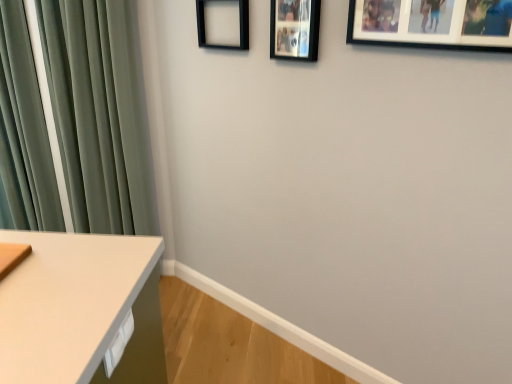
Question: From the image's perspective, is black matte picture frame at upper center, marked as the second picture frame in a right-to-left arrangement, below green velvet curtain at left?

Choices:
 (A) no
 (B) yes

Answer: (A)

Question: Does black matte picture frame at upper center, marked as the second picture frame in a right-to-left arrangement, have a larger size compared to green velvet curtain at left?

Choices:
 (A) no
 (B) yes

Answer: (A)

Question: Is black matte picture frame at upper center, placed as the 2th picture frame when sorted from back to front, at the right side of green velvet curtain at left?

Choices:
 (A) no
 (B) yes

Answer: (B)

Question: Does black matte picture frame at upper center, marked as the second picture frame in a right-to-left arrangement, have a lesser width compared to green velvet curtain at left?

Choices:
 (A) yes
 (B) no

Answer: (A)

Question: From a real-world perspective, is black matte picture frame at upper center, marked as the second picture frame in a right-to-left arrangement, physically above green velvet curtain at left?

Choices:
 (A) yes
 (B) no

Answer: (A)

Question: In terms of height, does black matte picture frame at upper right, which is the third picture frame from back to front, look taller or shorter compared to black matte picture frame at upper center, positioned as the 3th picture frame in front-to-back order?

Choices:
 (A) short
 (B) tall

Answer: (A)

Question: Looking at their shapes, would you say black matte picture frame at upper right, the 1th picture frame in the front-to-back sequence, is wider or thinner than black matte picture frame at upper center, the 1th picture frame positioned from the back?

Choices:
 (A) thin
 (B) wide

Answer: (B)

Question: From the image's perspective, is black matte picture frame at upper right, the 1th picture frame in the front-to-back sequence, positioned above or below black matte picture frame at upper center, which is the 3th picture frame in right-to-left order?

Choices:
 (A) below
 (B) above

Answer: (A)

Question: Which is correct: black matte picture frame at upper right, which is the third picture frame from back to front, is inside black matte picture frame at upper center, the 1th picture frame positioned from the back, or outside of it?

Choices:
 (A) outside
 (B) inside

Answer: (A)

Question: Based on their positions, is white glossy drawer at lower left located to the left or right of black matte picture frame at upper center, which appears as the first picture frame when viewed from the left?

Choices:
 (A) left
 (B) right

Answer: (A)

Question: Is white glossy drawer at lower left wider or thinner than black matte picture frame at upper center, which appears as the first picture frame when viewed from the left?

Choices:
 (A) thin
 (B) wide

Answer: (A)

Question: Is white glossy drawer at lower left in front of or behind black matte picture frame at upper center, which is the 3th picture frame in right-to-left order, in the image?

Choices:
 (A) behind
 (B) front

Answer: (B)

Question: From the image's perspective, is white glossy drawer at lower left above or below black matte picture frame at upper center, positioned as the 3th picture frame in front-to-back order?

Choices:
 (A) above
 (B) below

Answer: (B)

Question: From their relative heights in the image, would you say black matte picture frame at upper center, positioned as the 3th picture frame in front-to-back order, is taller or shorter than black matte picture frame at upper center, which is the second picture frame in left-to-right order?

Choices:
 (A) short
 (B) tall

Answer: (A)

Question: From a real-world perspective, relative to black matte picture frame at upper center, marked as the second picture frame in a right-to-left arrangement, is black matte picture frame at upper center, positioned as the 3th picture frame in front-to-back order, vertically above or below?

Choices:
 (A) below
 (B) above

Answer: (A)